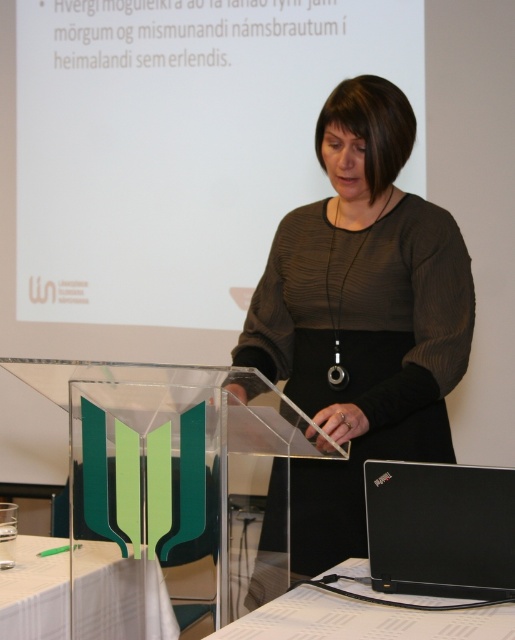
Who is positioned more to the right, matte black dress at center or black matte laptop at lower right?

Positioned to the right is black matte laptop at lower right.

Which is behind, point (290, 374) or point (501, 476)?

The point (290, 374) is more distant.

In order to click on matte black dress at center in this screenshot , I will do `click(362, 317)`.

Does point (104, 586) come in front of point (300, 605)?

That is False.

Measure the distance between point (52,609) and camera.

Point (52,609) is 1.71 meters away from camera.

Locate an element on the screen. white glossy table at lower left is located at coordinates (35, 593).

Is point (375, 180) closer to camera compared to point (37, 620)?

No.

Is matte black dress at center thinner than white glossy table at lower left?

Incorrect, matte black dress at center's width is not less than white glossy table at lower left's.

Locate an element on the screen. The width and height of the screenshot is (515, 640). matte black dress at center is located at coordinates (362, 317).